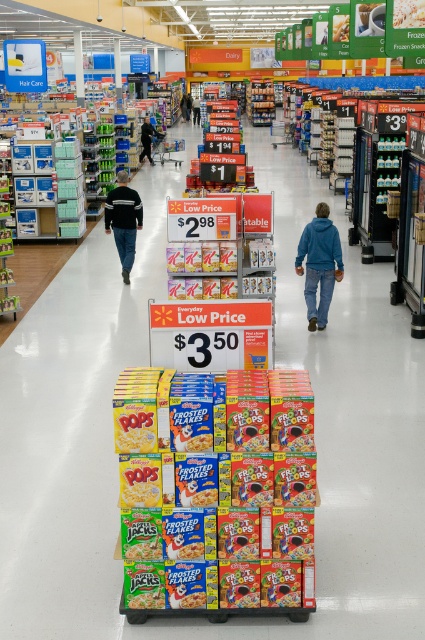
Which of these two, multicolored cardboard frosted flakes at center or black fleece jacket at left, stands shorter?

multicolored cardboard frosted flakes at center is shorter.

Can you confirm if multicolored cardboard frosted flakes at center is thinner than black fleece jacket at left?

No, multicolored cardboard frosted flakes at center is not thinner than black fleece jacket at left.

Find the location of a particular element. The image size is (425, 640). multicolored cardboard frosted flakes at center is located at coordinates (215, 513).

Where is `multicolored cardboard frosted flakes at center`? The height and width of the screenshot is (640, 425). multicolored cardboard frosted flakes at center is located at coordinates (215, 513).

From the picture: Is blue fleece jacket at center thinner than black fleece jacket at left?

No, blue fleece jacket at center is not thinner than black fleece jacket at left.

Between point (320, 211) and point (122, 273), which one is positioned in front?

Point (320, 211) is in front.

Between point (308, 301) and point (132, 228), which one is positioned behind?

Point (132, 228)

Where is `blue fleece jacket at center`? blue fleece jacket at center is located at coordinates (319, 264).

Is multicolored cardboard frosted flakes at center thinner than dark blue jeans at center?

No, multicolored cardboard frosted flakes at center is not thinner than dark blue jeans at center.

Does multicolored cardboard frosted flakes at center have a greater height compared to dark blue jeans at center?

Yes, multicolored cardboard frosted flakes at center is taller than dark blue jeans at center.

Does point (124, 572) lie in front of point (147, 128)?

Yes, it is.

At what (x,y) coordinates should I click in order to perform the action: click on multicolored cardboard frosted flakes at center. Please return your answer as a coordinate pair (x, y). Looking at the image, I should click on (215, 513).